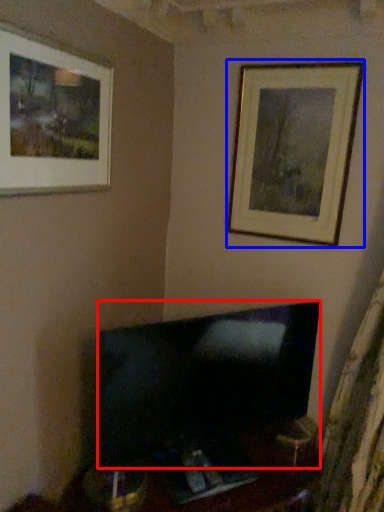
Question: Which of the following is the farthest to the observer, television (highlighted by a red box) or picture frame (highlighted by a blue box)?

Choices:
 (A) television
 (B) picture frame

Answer: (B)